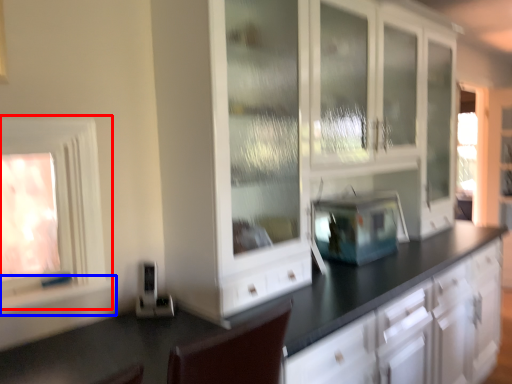
Question: Which of the following is the farthest to the observer, window (highlighted by a red box) or window sill (highlighted by a blue box)?

Choices:
 (A) window
 (B) window sill

Answer: (B)